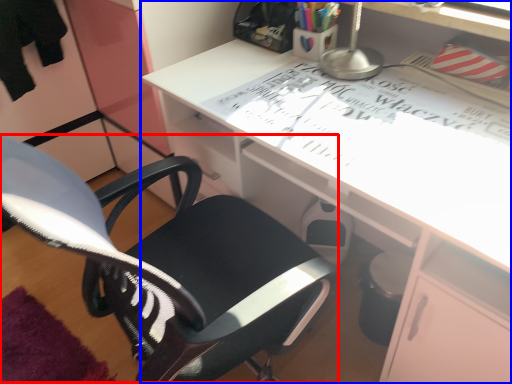
Question: Which object appears farthest to the camera in this image, computer chair (highlighted by a red box) or desk (highlighted by a blue box)?

Choices:
 (A) computer chair
 (B) desk

Answer: (B)